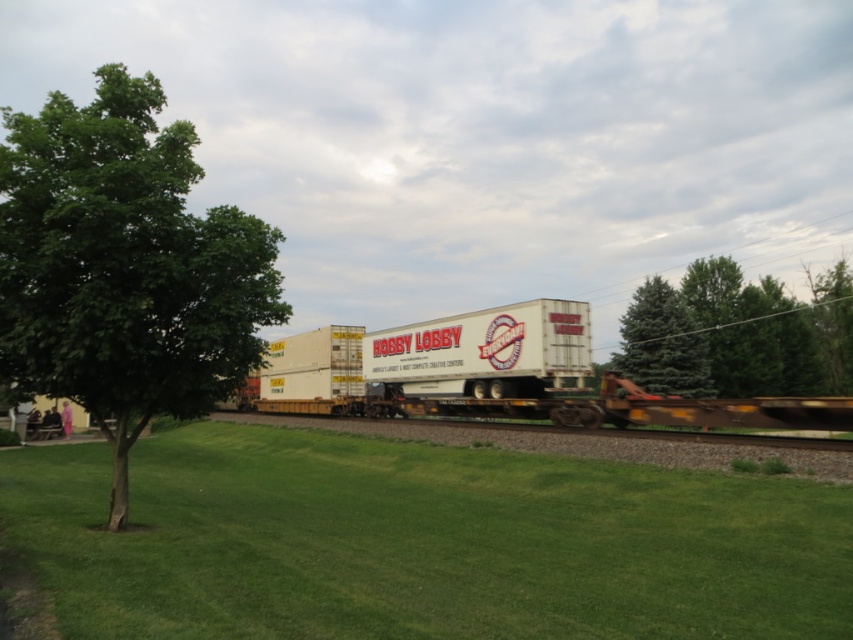
You are a bird flying over the railway scene. You want to land on the closest tree to the Hobby Lobby container. Which tree should you choose between the green fir tree at right and the green leafy tree at upper right?

The green fir tree at right is closer to the Hobby Lobby container than the green leafy tree at upper right, so you should choose the green fir tree at right to land on.

You are a photographer planning to capture the entire scene of the flatbed train car with the Hobby Lobby container. You notice the green grass at center and the green fir tree at right in your viewfinder. Which of these two elements occupies a wider area in the image?

The green grass at center occupies a wider area in the image compared to the green fir tree at right, as its width surpasses that of the fir tree.

You are a photographer trying to capture the train scene. You notice the green grass at center and the green leafy tree at left in your viewfinder. Which object appears taller in the photo?

The green leafy tree at left appears taller than the green grass at center in the photo because the green grass at center is not as tall as the green leafy tree at left.